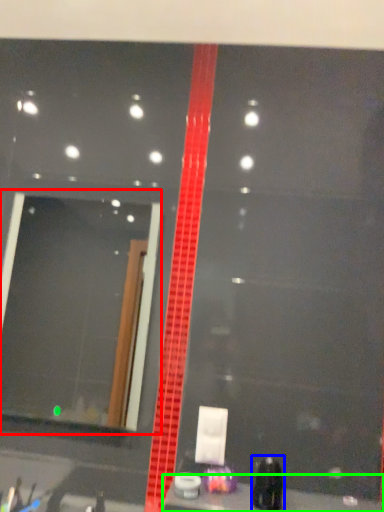
Question: Considering the real-world distances, which object is farthest from mirror (highlighted by a red box)? toiletry (highlighted by a blue box) or counter top (highlighted by a green box)?

Choices:
 (A) toiletry
 (B) counter top

Answer: (A)